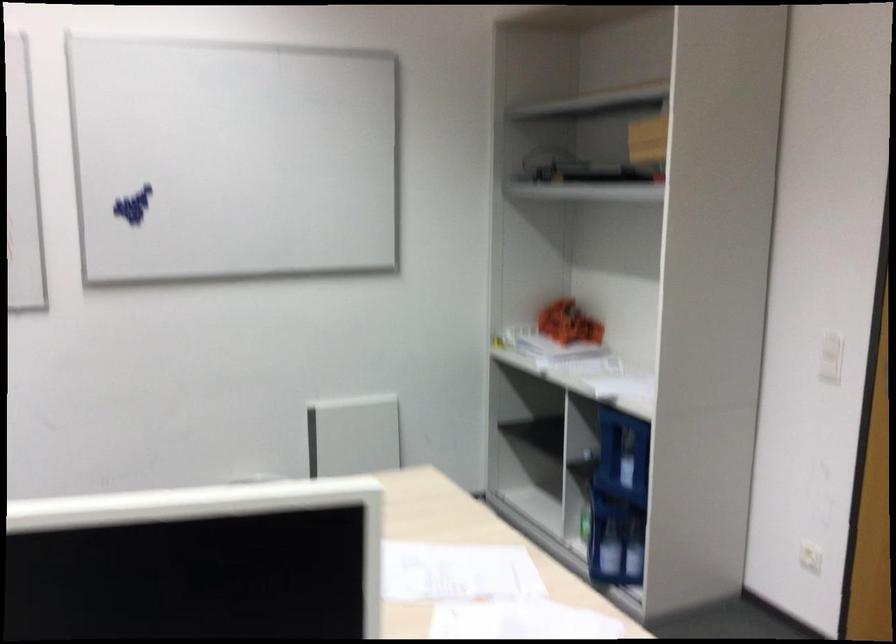
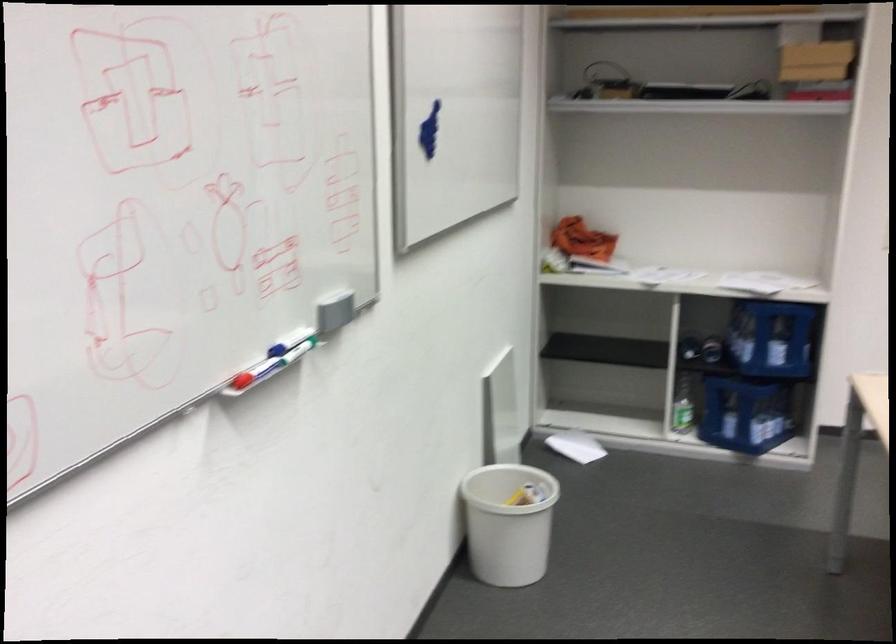
In the second image, find the point that corresponds to pixel 659 525 in the first image.

(745, 413)